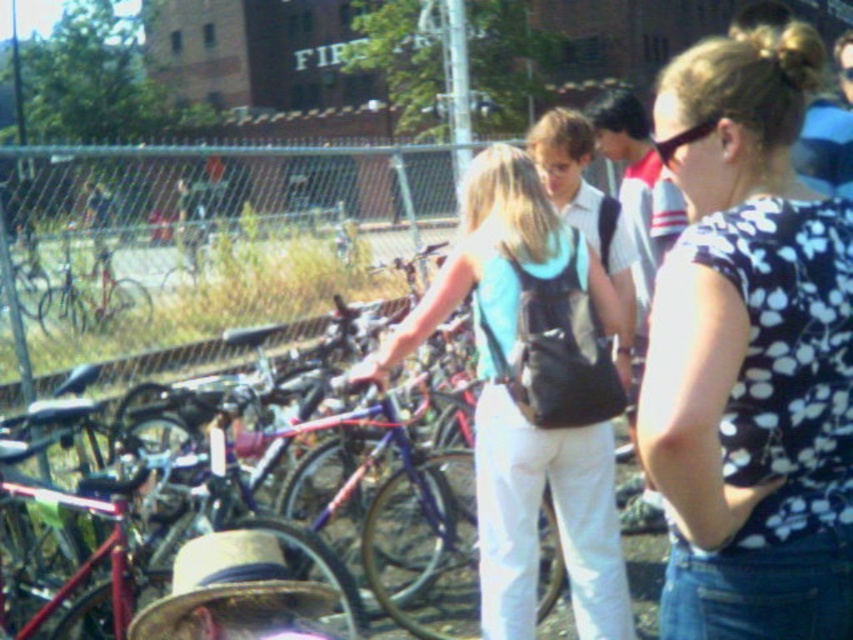
Question: Is metallic blue bicycle at center wider than strawtexturehat at lower left?

Choices:
 (A) yes
 (B) no

Answer: (A)

Question: Is floral print shirt at center wider than strawtexturehat at lower left?

Choices:
 (A) yes
 (B) no

Answer: (B)

Question: Which of the following is the closest to the observer?

Choices:
 (A) (801, 480)
 (B) (428, 586)
 (C) (183, 554)

Answer: (A)

Question: Which object is closer to the camera taking this photo?

Choices:
 (A) light blue fabric backpack at center
 (B) metallic blue bicycle at center
 (C) strawtexturehat at lower left
 (D) floral print shirt at center

Answer: (D)

Question: Which point appears closest to the camera in this image?

Choices:
 (A) (590, 516)
 (B) (100, 531)

Answer: (A)

Question: Is the position of floral print shirt at center less distant than that of metallic blue bicycle at center?

Choices:
 (A) yes
 (B) no

Answer: (A)